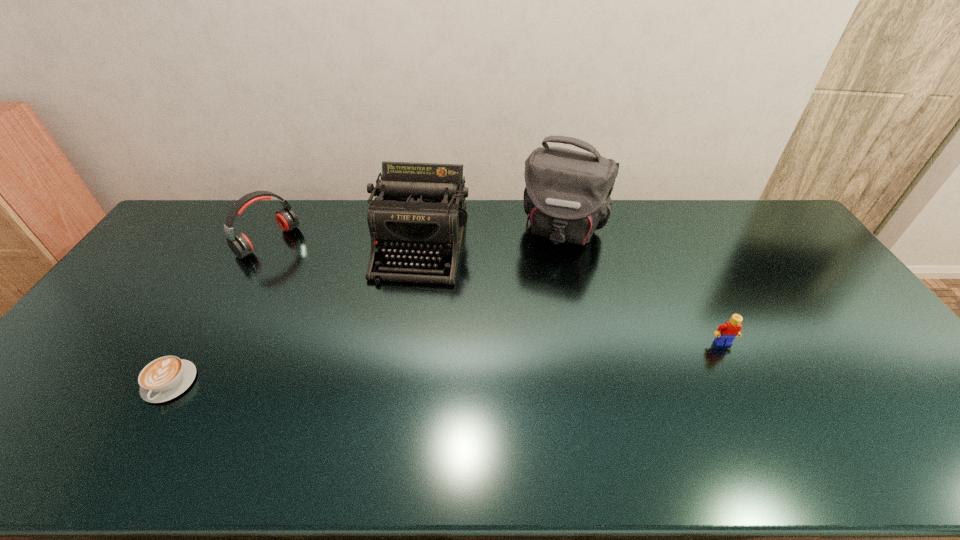
The image size is (960, 540). Identify the location of shoulder bag that is at the far edge. (567, 197).

Locate an element on the screen. The image size is (960, 540). object present at the near edge is located at coordinates (163, 379).

In the image, there is a desktop. Identify the location of vacant space at the far edge. coord(508,217).

What are the coordinates of `vacant region at the near edge of the desktop` in the screenshot? It's located at (524, 400).

Image resolution: width=960 pixels, height=540 pixels. Identify the location of free space at the left edge of the desktop. (123, 345).

The width and height of the screenshot is (960, 540). What are the coordinates of `free region at the right edge of the desktop` in the screenshot? It's located at coord(852,340).

The height and width of the screenshot is (540, 960). In order to click on free space at the far left corner of the desktop in this screenshot , I will do `click(215, 202)`.

This screenshot has width=960, height=540. Find the location of `unoccupied area between the fourth shortest object and the shoulder bag`. unoccupied area between the fourth shortest object and the shoulder bag is located at coordinates (492, 237).

The width and height of the screenshot is (960, 540). In order to click on vacant space that's between the fourth object from left to right and the rightmost object in this screenshot , I will do `click(643, 286)`.

Image resolution: width=960 pixels, height=540 pixels. Identify the location of empty location between the rightmost object and the third object from left to right. (572, 294).